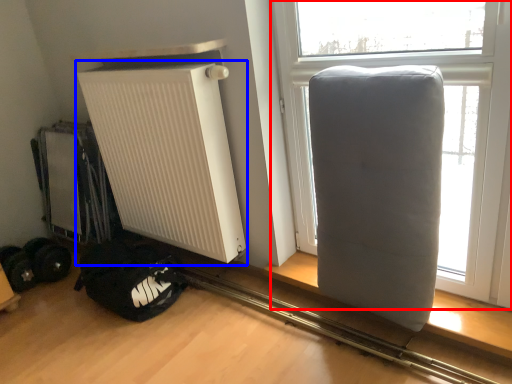
Question: Which of the following is the closest to the observer, window (highlighted by a red box) or radiator (highlighted by a blue box)?

Choices:
 (A) window
 (B) radiator

Answer: (A)